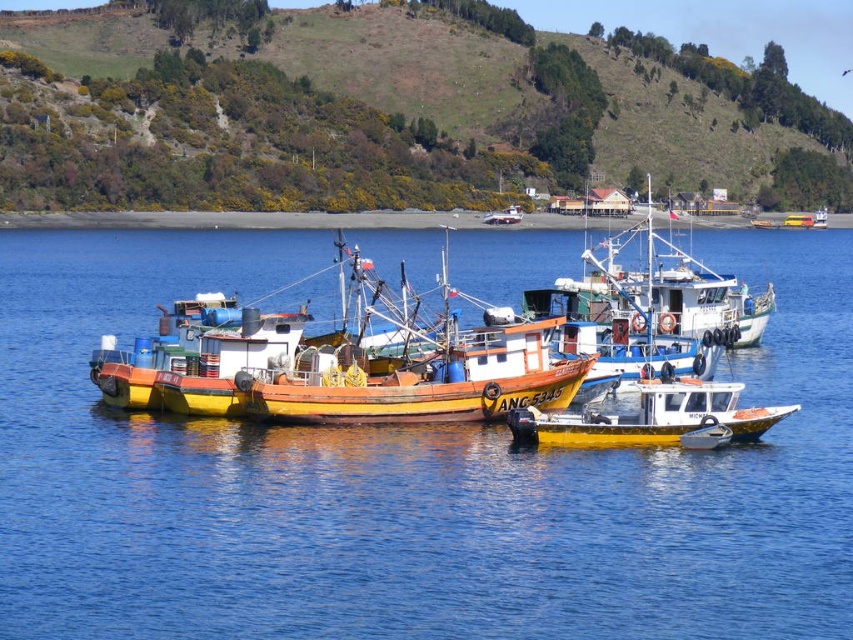
You are standing on the dock and see the point marked at coordinates (403, 480). What is the location of this point relative to the blue water at center?

The point marked at coordinates (403, 480) is located on the blue water at center.

You are a photographer planning to capture the entire scene of the coastal area. You notice the blue water at center and the green grassy hillside at upper center. Which of these two elements has a narrower width in the image?

The blue water at center has a lesser width compared to the green grassy hillside at upper center, so the blue water at center is narrower in width.